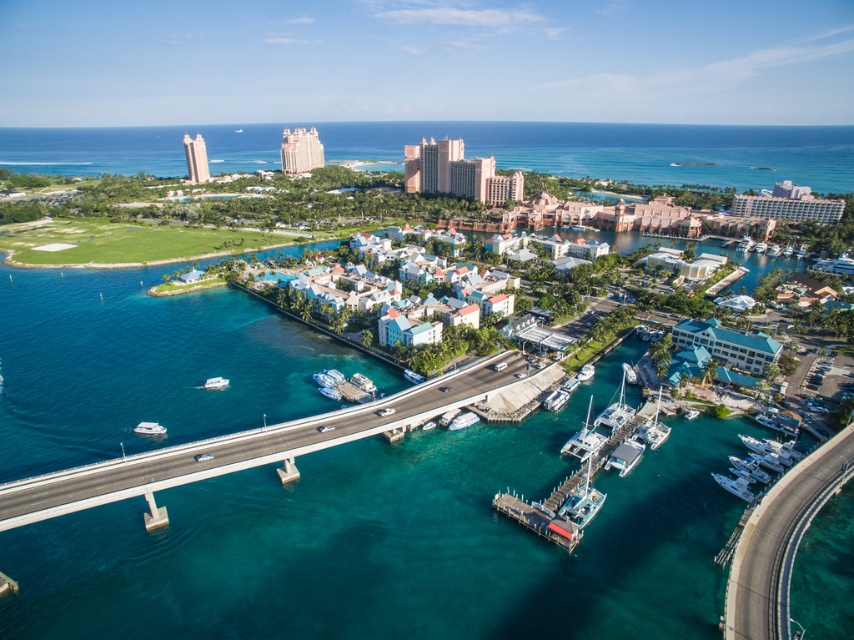
Is white matte boat at center smaller than white glossy boat at lower left?

No, white matte boat at center is not smaller than white glossy boat at lower left.

The image size is (854, 640). Identify the location of white matte boat at center. (461, 420).

Is white matte sailboat at lower right positioned behind white matte boat at center?

No, it is in front of white matte boat at center.

Does white matte sailboat at lower right appear under white matte boat at center?

No.

Identify the location of white matte sailboat at lower right. pyautogui.click(x=616, y=408).

Find the location of a particular element. white matte sailboat at lower right is located at coordinates (616, 408).

Between white matte boat at center and white matte boat at lower left, which one appears on the right side from the viewer's perspective?

white matte boat at center

Is white matte boat at center shorter than white matte boat at lower left?

In fact, white matte boat at center may be taller than white matte boat at lower left.

Does point (461, 428) lie in front of point (161, 424)?

Yes.

The image size is (854, 640). I want to click on white matte boat at center, so click(x=461, y=420).